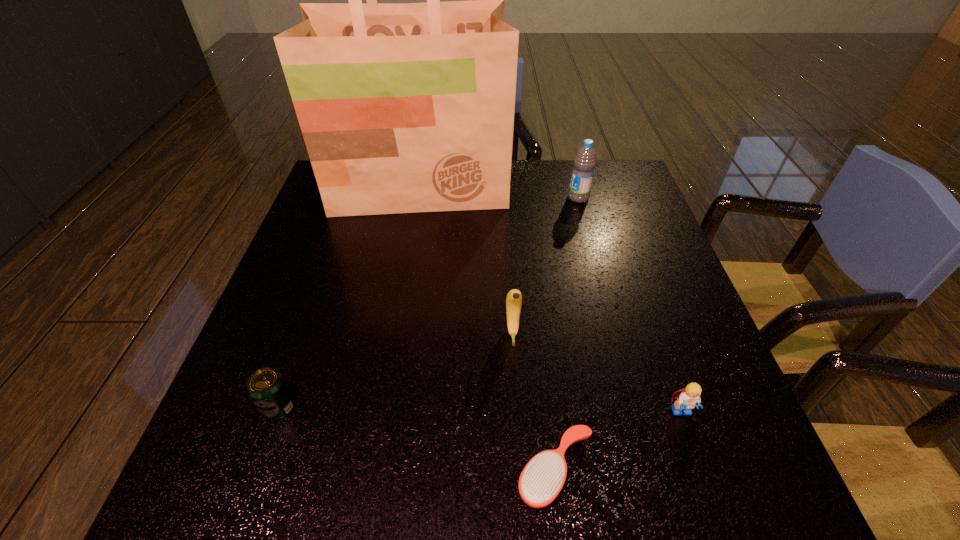
Locate an element on the screen. The height and width of the screenshot is (540, 960). the tallest object is located at coordinates (404, 108).

Where is `water bottle`? Image resolution: width=960 pixels, height=540 pixels. water bottle is located at coordinates (584, 162).

This screenshot has width=960, height=540. Identify the location of the second tallest object. (584, 162).

This screenshot has height=540, width=960. I want to click on the third tallest object, so click(x=514, y=297).

I want to click on the fourth nearest object, so click(514, 297).

The height and width of the screenshot is (540, 960). Find the location of `beer can`. beer can is located at coordinates (267, 388).

Locate an element on the screen. Image resolution: width=960 pixels, height=540 pixels. the rightmost object is located at coordinates (687, 398).

I want to click on the nearest object, so click(542, 479).

In order to click on hairbrush in this screenshot , I will do `click(542, 479)`.

Locate an element on the screen. free space located 0.150m on the front of the tallest object is located at coordinates (408, 255).